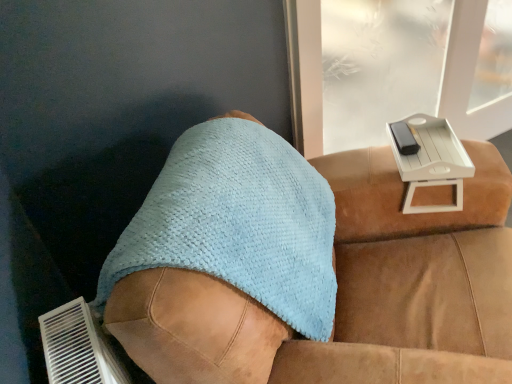
Question: Looking at the image, does light brown leather couch at center seem bigger or smaller compared to light blue textured towel at center?

Choices:
 (A) big
 (B) small

Answer: (A)

Question: From a real-world perspective, is light brown leather couch at center physically located above or below light blue textured towel at center?

Choices:
 (A) below
 (B) above

Answer: (A)

Question: Which is farther from the light brown leather couch at center?

Choices:
 (A) light blue textured towel at center
 (B) white plastic tray at upper right

Answer: (B)

Question: Estimate the real-world distances between objects in this image. Which object is closer to the light brown leather couch at center?

Choices:
 (A) white plastic tray at upper right
 (B) light blue textured towel at center

Answer: (B)